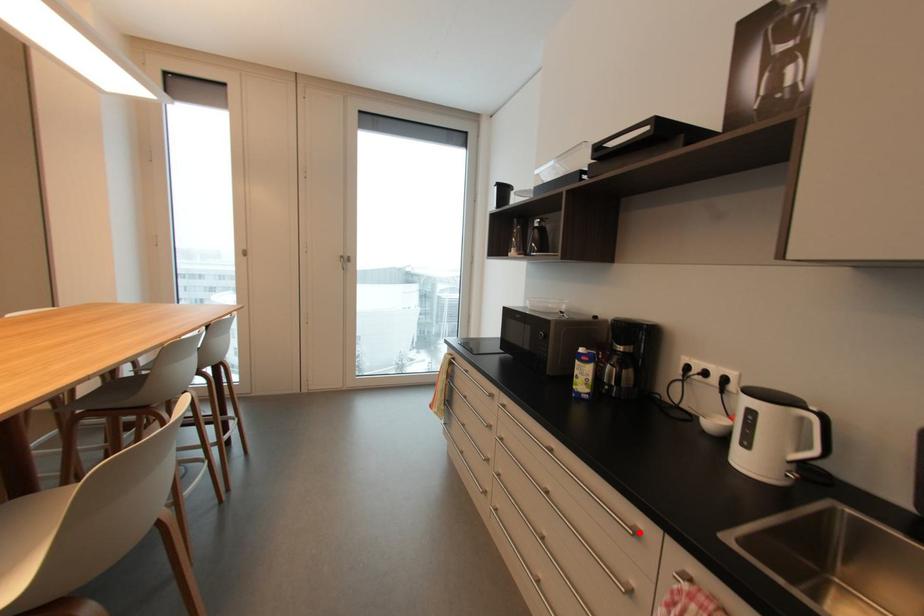
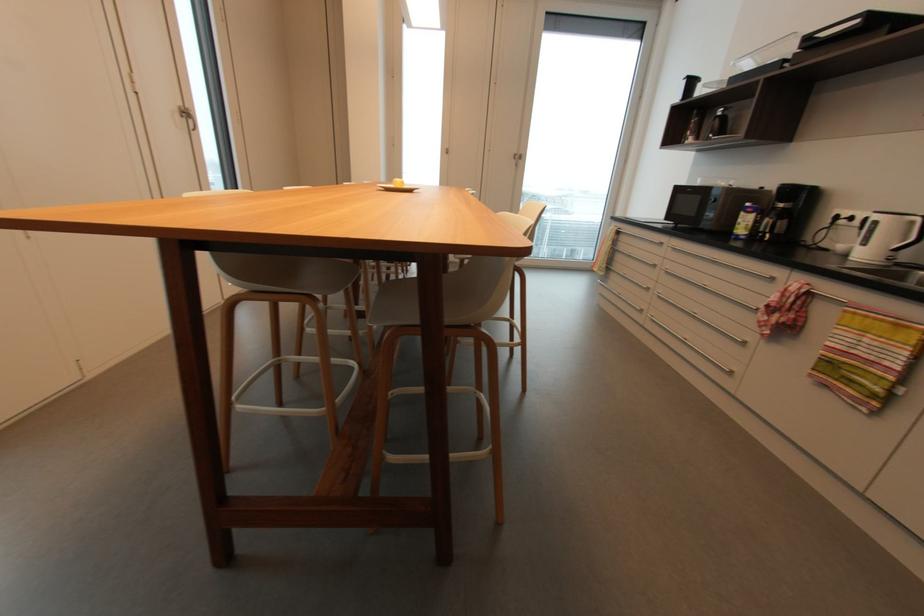
The point at the highlighted location is marked in the first image. Where is the corresponding point in the second image?

(775, 280)